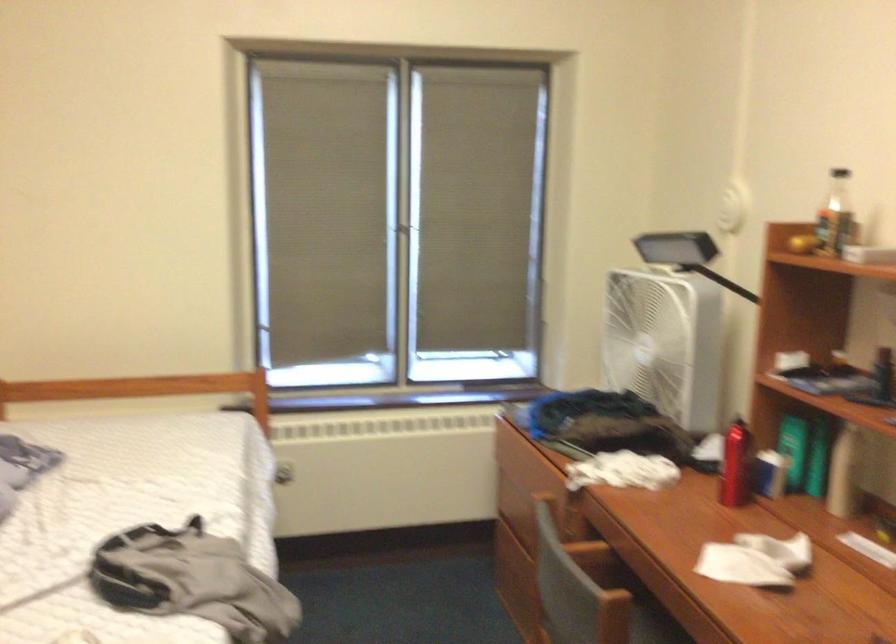
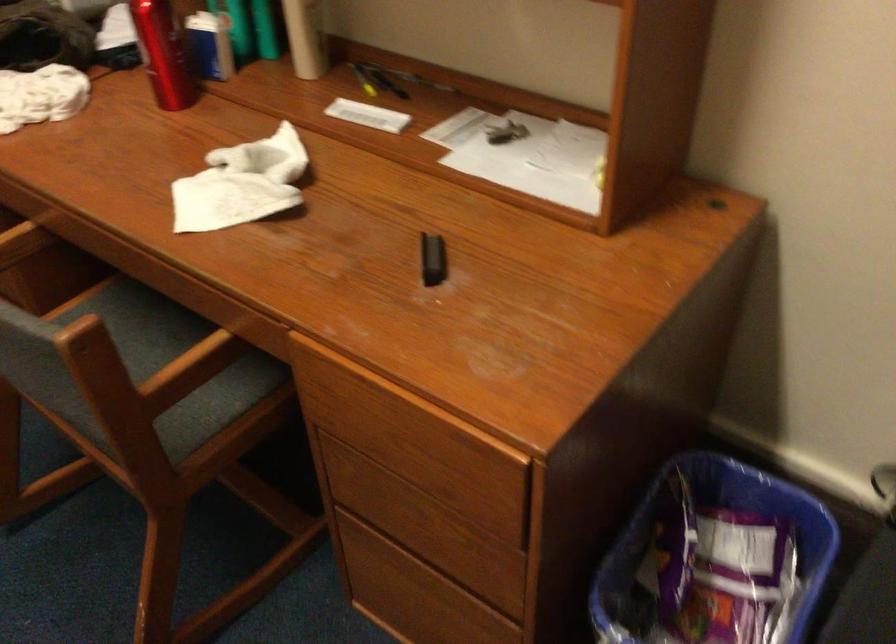
Locate, in the second image, the point that corresponds to point 734,466 in the first image.

(162, 53)